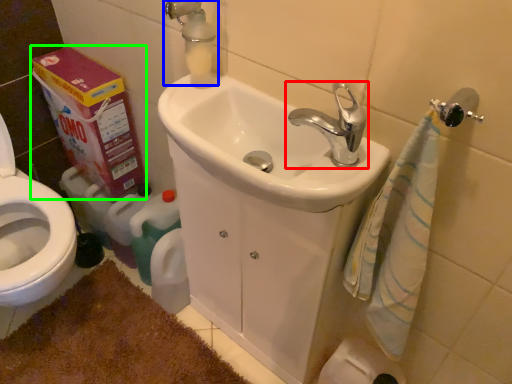
Question: Which is nearer to the tap (highlighted by a red box)? plumbing fixture (highlighted by a blue box) or carton (highlighted by a green box).

Choices:
 (A) plumbing fixture
 (B) carton

Answer: (A)